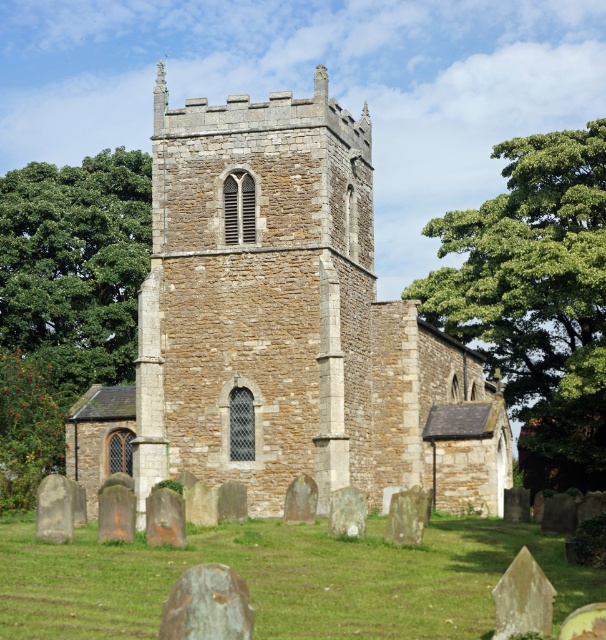
Between green leafy tree at upper right and green leafy tree at left, which one is positioned lower?

Positioned lower is green leafy tree at upper right.

Between point (601, 140) and point (38, 189), which one is positioned behind?

Positioned behind is point (38, 189).

I want to click on green leafy tree at upper right, so [536, 298].

Between brown stone church at center and green leafy tree at left, which one appears on the right side from the viewer's perspective?

brown stone church at center

Is point (208, 241) positioned before point (82, 230)?

That is True.

Where is `brown stone church at center`? brown stone church at center is located at coordinates (282, 326).

Is the position of brown stone church at center less distant than that of green leafy tree at upper right?

Yes, brown stone church at center is in front of green leafy tree at upper right.

Who is taller, brown stone church at center or green leafy tree at upper right?

With more height is brown stone church at center.

Who is more forward, (211, 472) or (521, 330)?

Positioned in front is point (211, 472).

You are a GUI agent. You are given a task and a screenshot of the screen. Output one action in this format:
    pyautogui.click(x=<x>, y=<y>)
    Task: Click on the brown stone church at center
    
    Given the screenshot: What is the action you would take?
    pyautogui.click(x=282, y=326)